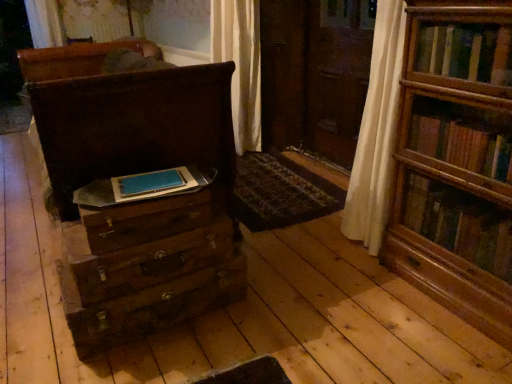
I want to click on vacant space in front of wooden bookshelf at right, so click(452, 345).